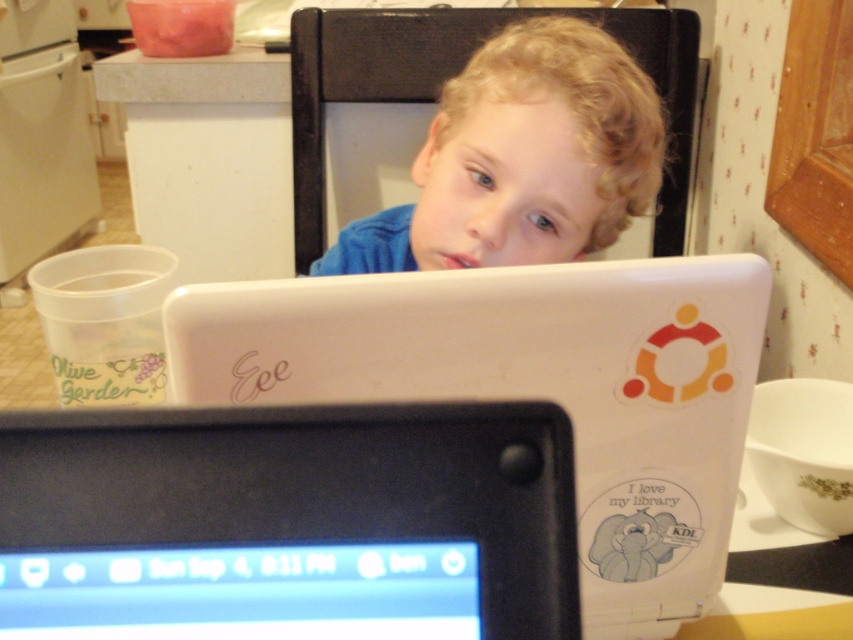
You are a teacher observing a student working on a laptop. The student has a white matte laptop at center and a black glossy screen at center in front of them. Which object is taller?

The white matte laptop at center is taller than the black glossy screen at center.